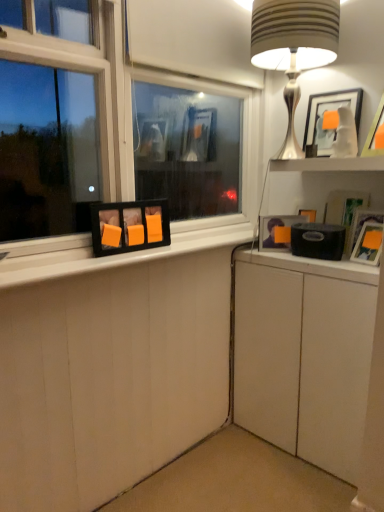
Question: Is matte black picture frame at right, which is counted as the second picture frame, starting from the left, not within satin silver table lamp at upper right?

Choices:
 (A) no
 (B) yes

Answer: (B)

Question: Can you confirm if matte black picture frame at right, positioned as the 3th picture frame in right-to-left order, is thinner than satin silver table lamp at upper right?

Choices:
 (A) yes
 (B) no

Answer: (A)

Question: From the image's perspective, is matte black picture frame at right, positioned as the 3th picture frame in right-to-left order, on satin silver table lamp at upper right?

Choices:
 (A) yes
 (B) no

Answer: (B)

Question: From a real-world perspective, is matte black picture frame at right, positioned as the 3th picture frame in right-to-left order, physically below satin silver table lamp at upper right?

Choices:
 (A) yes
 (B) no

Answer: (A)

Question: Is matte black picture frame at right, which is counted as the second picture frame, starting from the left, facing towards satin silver table lamp at upper right?

Choices:
 (A) no
 (B) yes

Answer: (A)

Question: Considering the relative sizes of matte black picture frame at right, positioned as the 3th picture frame in right-to-left order, and satin silver table lamp at upper right in the image provided, is matte black picture frame at right, positioned as the 3th picture frame in right-to-left order, shorter than satin silver table lamp at upper right?

Choices:
 (A) no
 (B) yes

Answer: (B)

Question: Is white matte cabinet at lower right touching orange matte picture frame at lower left, positioned as the first picture frame in left-to-right order?

Choices:
 (A) no
 (B) yes

Answer: (A)

Question: From a real-world perspective, is white matte cabinet at lower right over orange matte picture frame at lower left, positioned as the first picture frame in left-to-right order?

Choices:
 (A) yes
 (B) no

Answer: (B)

Question: Is there a large distance between white matte cabinet at lower right and orange matte picture frame at lower left, which ranks as the 4th picture frame in right-to-left order?

Choices:
 (A) no
 (B) yes

Answer: (A)

Question: Considering the relative sizes of white matte cabinet at lower right and orange matte picture frame at lower left, positioned as the first picture frame in left-to-right order, in the image provided, is white matte cabinet at lower right smaller than orange matte picture frame at lower left, positioned as the first picture frame in left-to-right order,?

Choices:
 (A) yes
 (B) no

Answer: (B)

Question: Is white matte cabinet at lower right at the left side of orange matte picture frame at lower left, which ranks as the 4th picture frame in right-to-left order?

Choices:
 (A) yes
 (B) no

Answer: (B)

Question: Does white matte cabinet at lower right contain orange matte picture frame at lower left, which ranks as the 4th picture frame in right-to-left order?

Choices:
 (A) no
 (B) yes

Answer: (A)

Question: Considering the relative sizes of matte white picture frame at upper right, the third picture frame from the left, and white glossy shelf at upper right in the image provided, is matte white picture frame at upper right, the third picture frame from the left, taller than white glossy shelf at upper right?

Choices:
 (A) yes
 (B) no

Answer: (A)